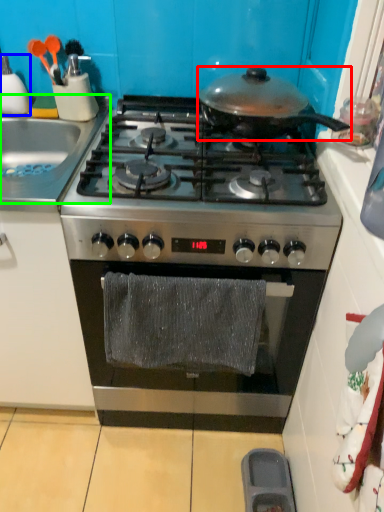
Question: Which object is positioned closest to kitchen appliance (highlighted by a red box)? Select from kitchen appliance (highlighted by a blue box) and sink (highlighted by a green box).

Choices:
 (A) kitchen appliance
 (B) sink

Answer: (B)